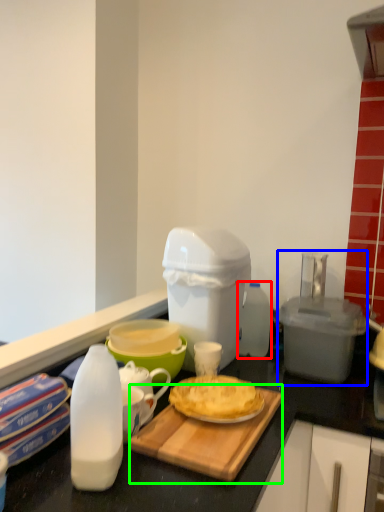
Question: Estimate the real-world distances between objects in this image. Which object is closer to bottle (highlighted by a red box), appliance (highlighted by a blue box) or cutting board (highlighted by a green box)?

Choices:
 (A) appliance
 (B) cutting board

Answer: (A)